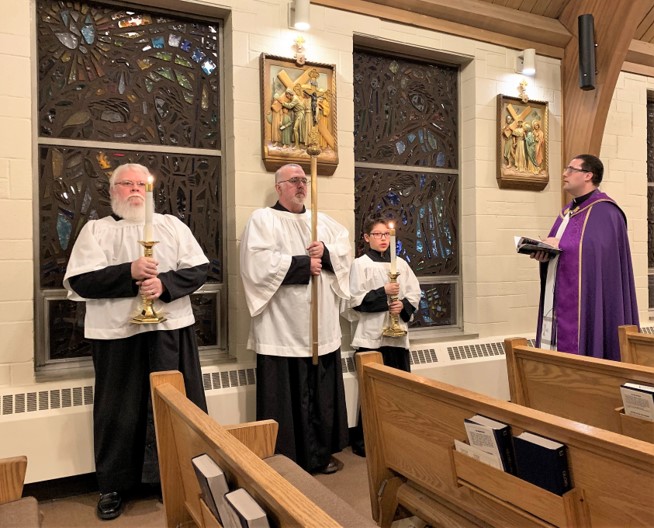
I want to click on candle, so click(390, 252), click(143, 214).